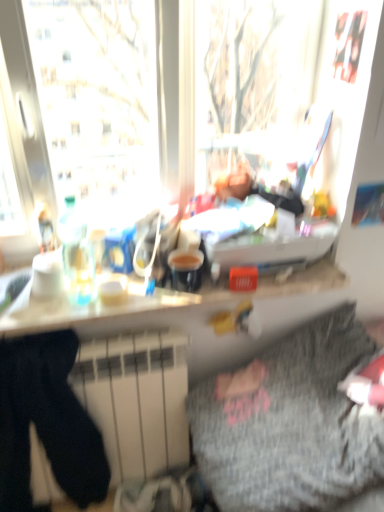
Question: In terms of height, does white matte radiator at lower left look taller or shorter compared to black cotton sweat pants at lower left?

Choices:
 (A) short
 (B) tall

Answer: (A)

Question: Considering their positions, is white matte radiator at lower left located in front of or behind black cotton sweat pants at lower left?

Choices:
 (A) front
 (B) behind

Answer: (B)

Question: Considering the real-world distances, which object is closest to the white glossy counter top at center?

Choices:
 (A) white matte radiator at lower left
 (B) gray textured blanket at lower right
 (C) black cotton sweat pants at lower left

Answer: (A)

Question: Based on their relative distances, which object is nearer to the black cotton sweat pants at lower left?

Choices:
 (A) gray textured blanket at lower right
 (B) white matte radiator at lower left
 (C) white glossy counter top at center

Answer: (B)